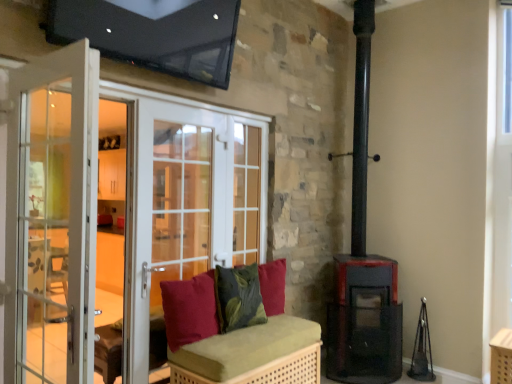
Question: From the image's perspective, is matte black stove at lower right under velvet red cushion at center, positioned as the third pillow in front-to-back order?

Choices:
 (A) no
 (B) yes

Answer: (B)

Question: Is matte black stove at lower right positioned with its back to velvet red cushion at center, positioned as the third pillow in front-to-back order?

Choices:
 (A) no
 (B) yes

Answer: (A)

Question: Is the position of matte black stove at lower right more distant than that of velvet red cushion at center, which is the first pillow from back to front?

Choices:
 (A) yes
 (B) no

Answer: (A)

Question: Considering the relative sizes of matte black stove at lower right and velvet red cushion at center, positioned as the third pillow in front-to-back order, in the image provided, is matte black stove at lower right shorter than velvet red cushion at center, positioned as the third pillow in front-to-back order,?

Choices:
 (A) no
 (B) yes

Answer: (A)

Question: Are matte black stove at lower right and velvet red cushion at center, which is the first pillow from back to front, far apart?

Choices:
 (A) no
 (B) yes

Answer: (A)

Question: Does point (262, 268) appear closer or farther from the camera than point (336, 360)?

Choices:
 (A) closer
 (B) farther

Answer: (A)

Question: Looking at their shapes, would you say velvet red cushion at center, which is the first pillow from back to front, is wider or thinner than matte black stove at lower right?

Choices:
 (A) wide
 (B) thin

Answer: (B)

Question: From the image's perspective, is velvet red cushion at center, positioned as the third pillow in front-to-back order, located above or below matte black stove at lower right?

Choices:
 (A) below
 (B) above

Answer: (B)

Question: Looking at the image, does velvet red cushion at center, which is the first pillow from back to front, seem bigger or smaller compared to matte black stove at lower right?

Choices:
 (A) small
 (B) big

Answer: (A)

Question: From a real-world perspective, relative to green woven bench at center, is green textured cushion at center, which is the second pillow from front to back, vertically above or below?

Choices:
 (A) above
 (B) below

Answer: (A)

Question: Is green textured cushion at center, which ranks as the second pillow in back-to-front order, in front of or behind green woven bench at center in the image?

Choices:
 (A) behind
 (B) front

Answer: (A)

Question: Considering the positions of green textured cushion at center, which is the second pillow from front to back, and green woven bench at center in the image, is green textured cushion at center, which is the second pillow from front to back, taller or shorter than green woven bench at center?

Choices:
 (A) tall
 (B) short

Answer: (B)

Question: Is green textured cushion at center, which ranks as the second pillow in back-to-front order, to the left or to the right of green woven bench at center in the image?

Choices:
 (A) right
 (B) left

Answer: (B)

Question: Considering the relative positions of matte black stove at lower right and green textured cushion at center, which is the second pillow from front to back, in the image provided, is matte black stove at lower right to the left or to the right of green textured cushion at center, which is the second pillow from front to back,?

Choices:
 (A) left
 (B) right

Answer: (B)

Question: Looking at their shapes, would you say matte black stove at lower right is wider or thinner than green textured cushion at center, which ranks as the second pillow in back-to-front order?

Choices:
 (A) wide
 (B) thin

Answer: (A)